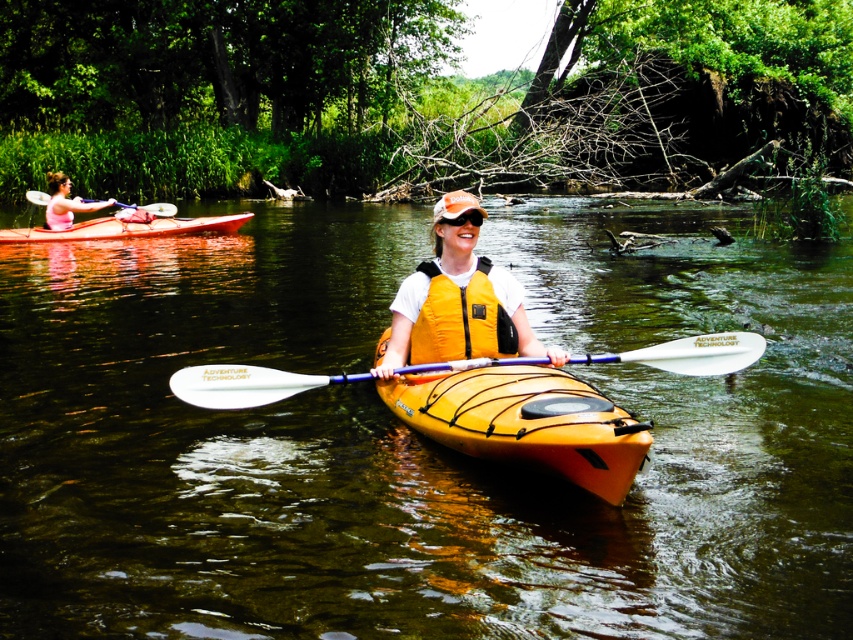
You are planning to place a small waterproof speaker on the yellow kayak at center. Given that the orange matte goggles at center are already placed there, will the speaker fit without overlapping?

The yellow kayak at center is wider than the orange matte goggles at center, so there should be enough space to place the speaker without overlapping.

You are planning to store the matte red canoe at left and the orange matte goggles at center in a storage locker. The locker has a width limit of 1 meter. Based on their widths, can both items fit side by side within the locker?

The matte red canoe at left might be wider than orange matte goggles at center, so there is a possibility that the combined width of both items exceeds the 1 meter limit. It is uncertain if they can fit without more precise measurements.

You are standing at the point labeled as point (41,228). You want to throw a small pebble to the viewer who is 18.82 meters away. If you can throw a pebble up to 20 meters, will you be able to reach the viewer?

The distance between point (41,228) and the viewer is 18.82 meters. Since your throwing range is up to 20 meters, you can successfully reach the viewer by throwing the pebble.